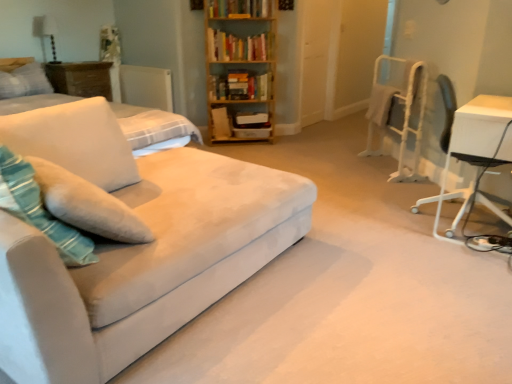
I want to click on free location to the right of suede couch at left, so click(358, 287).